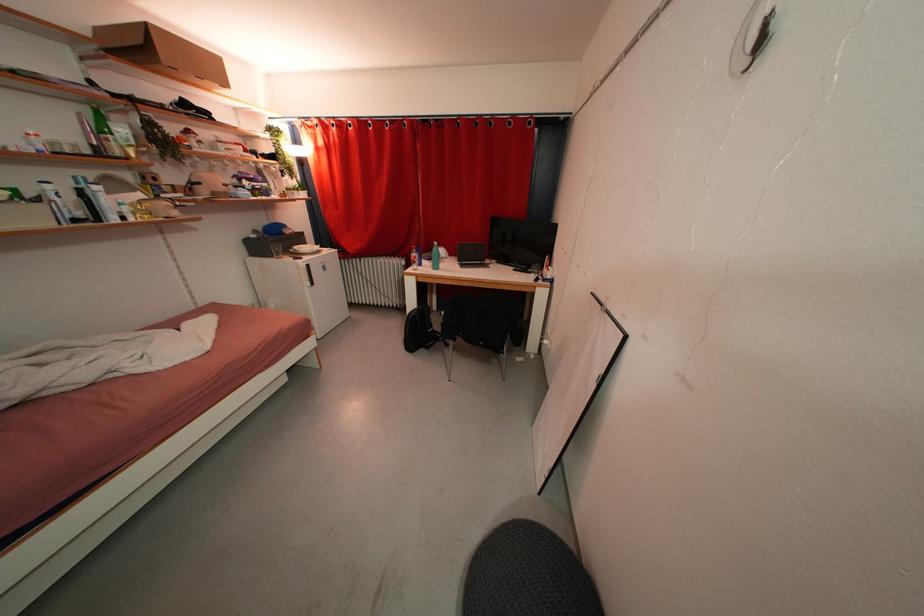
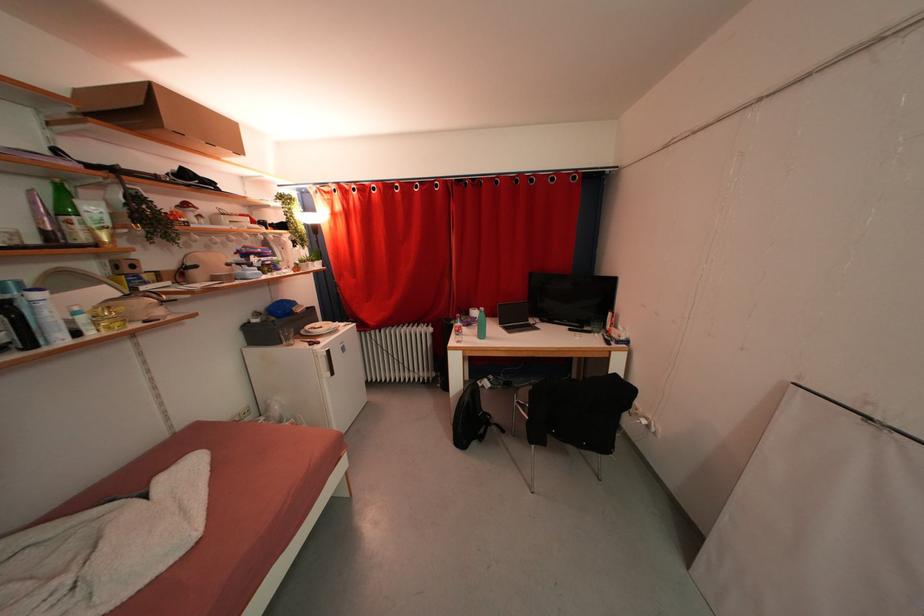
The point at (x=132, y=156) is marked in the first image. Where is the corresponding point in the second image?

(102, 241)